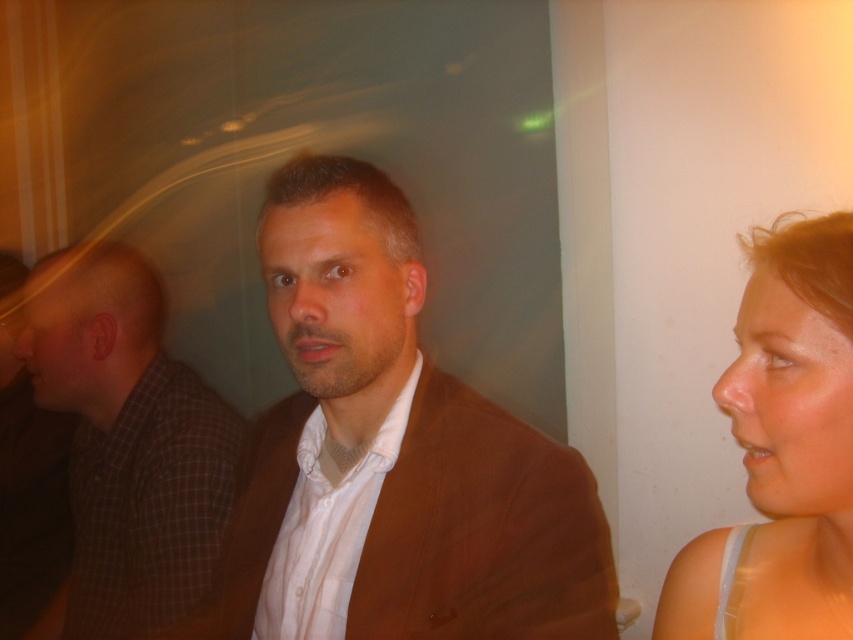
Who is shorter, brown fabric jacket at center or brown checkered shirt at left?

brown fabric jacket at center

Locate an element on the screen. brown fabric jacket at center is located at coordinates (392, 456).

Based on the photo, measure the distance between point (x=144, y=416) and camera.

Point (x=144, y=416) and camera are 1.35 meters apart from each other.

Between brown checkered shirt at left and smooth skin face at right, which one is positioned higher?

smooth skin face at right is higher up.

Measure the distance between point [44,380] and camera.

Point [44,380] is 1.42 meters from camera.

Locate an element on the screen. brown checkered shirt at left is located at coordinates (128, 442).

Is brown fabric jacket at center closer to camera compared to smooth skin face at right?

No, it is not.

Who is more distant from viewer, (404, 294) or (851, 372)?

The point (404, 294) is more distant.

Who is more distant from viewer, [405,289] or [807,227]?

The point [405,289] is behind.

Image resolution: width=853 pixels, height=640 pixels. I want to click on brown fabric jacket at center, so click(392, 456).